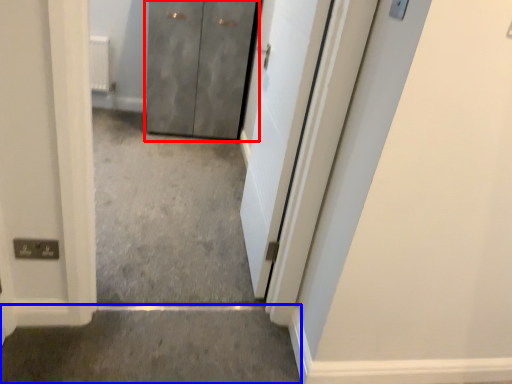
Question: Which object is further to the camera taking this photo, door (highlighted by a red box) or concrete (highlighted by a blue box)?

Choices:
 (A) door
 (B) concrete

Answer: (A)